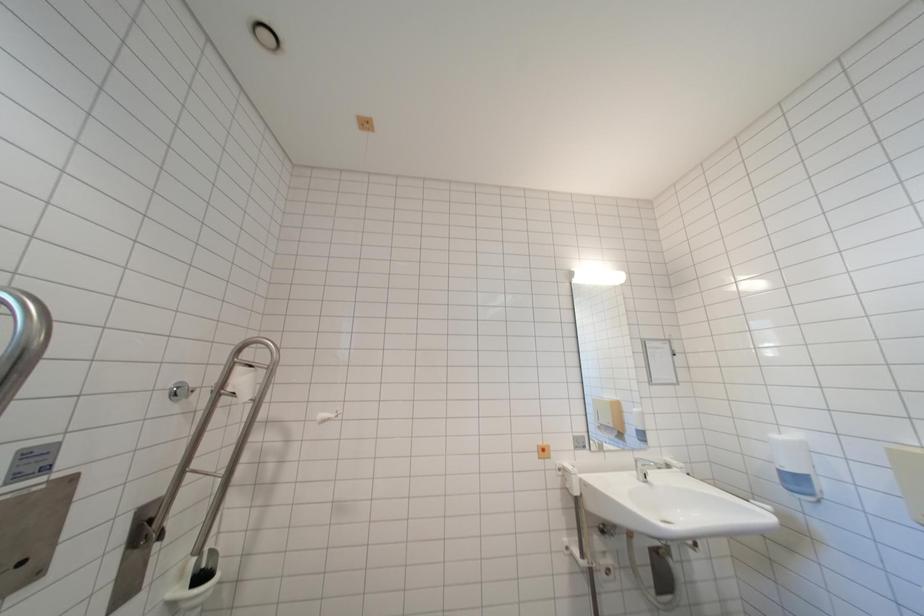
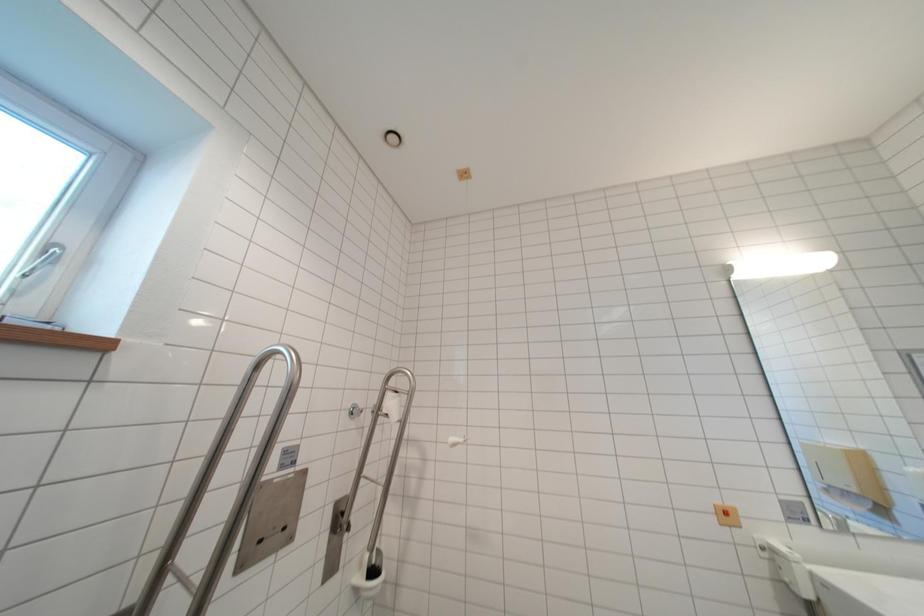
Question: Which direction would the cameraman need to move to produce the second image? Reply with the corresponding letter.

Choices:
 (A) Left
 (B) Right
 (C) Forward
 (D) Backward

Answer: (A)